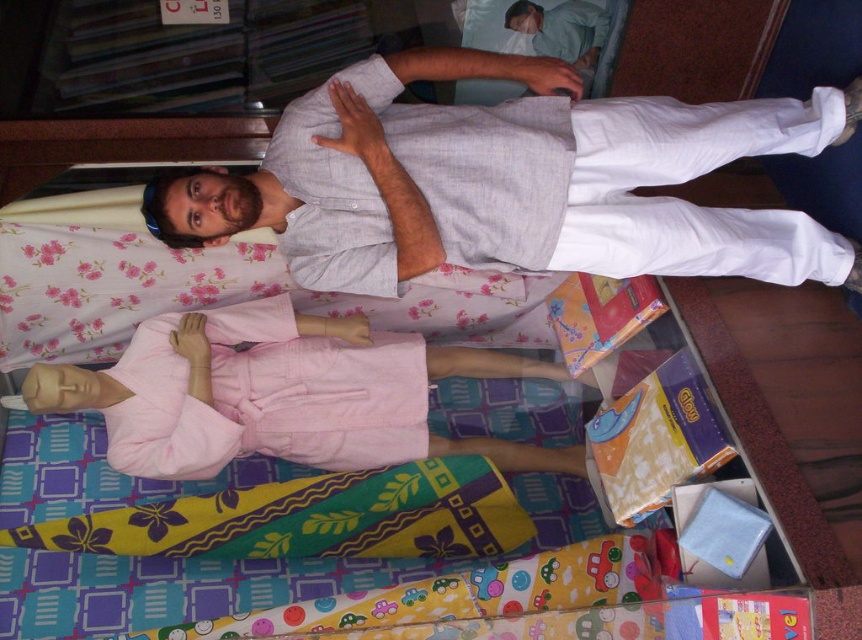
Question: Can you confirm if light gray cotton shirt at center is positioned below light blue cotton shirt at upper center?

Choices:
 (A) yes
 (B) no

Answer: (A)

Question: Which object is positioned closest to the light blue cotton shirt at upper center?

Choices:
 (A) pink cotton robe at lower left
 (B) light gray cotton shirt at center

Answer: (B)

Question: From the image, what is the correct spatial relationship of light gray cotton shirt at center in relation to pink cotton robe at lower left?

Choices:
 (A) right
 (B) left

Answer: (A)

Question: Does pink cotton robe at lower left appear on the left side of light blue cotton shirt at upper center?

Choices:
 (A) yes
 (B) no

Answer: (A)

Question: Which point is closer to the camera?

Choices:
 (A) pink cotton robe at lower left
 (B) light blue cotton shirt at upper center

Answer: (A)

Question: Which point is closer to the camera?

Choices:
 (A) light blue cotton shirt at upper center
 (B) pink cotton robe at lower left

Answer: (B)